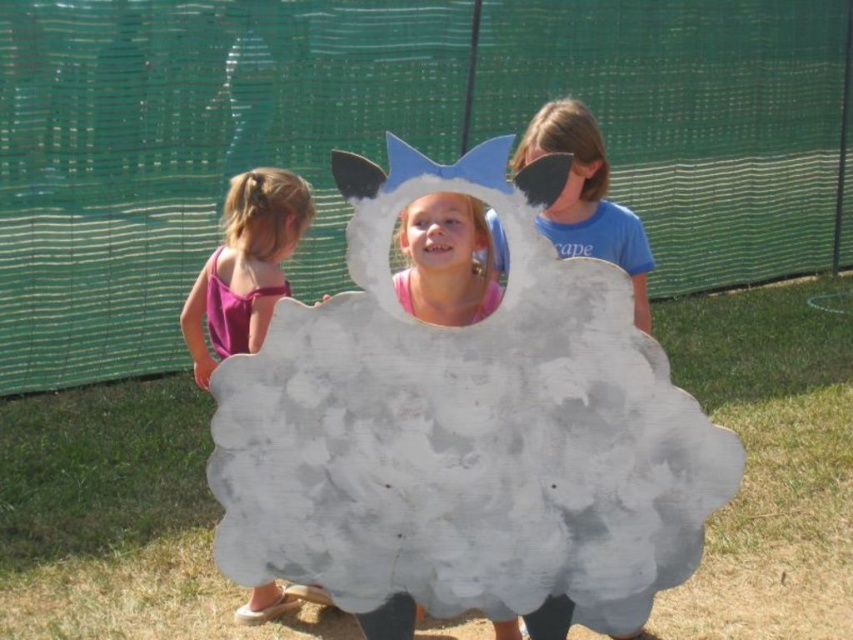
Can you confirm if white cotton cloud at center is shorter than matte pink dress at left?

In fact, white cotton cloud at center may be taller than matte pink dress at left.

Is white cotton cloud at center to the right of matte pink dress at left from the viewer's perspective?

Yes, white cotton cloud at center is to the right of matte pink dress at left.

This screenshot has width=853, height=640. What are the coordinates of `white cotton cloud at center` in the screenshot? It's located at (463, 432).

Is point (276, 202) positioned after point (480, 284)?

Yes, point (276, 202) is behind point (480, 284).

What do you see at coordinates (245, 266) in the screenshot? I see `matte pink dress at left` at bounding box center [245, 266].

Image resolution: width=853 pixels, height=640 pixels. What do you see at coordinates (245, 266) in the screenshot?
I see `matte pink dress at left` at bounding box center [245, 266].

This screenshot has height=640, width=853. In order to click on matte pink dress at left in this screenshot , I will do `click(245, 266)`.

Is matte pink dress at left taller than matte blue mask at center?

Indeed, matte pink dress at left has a greater height compared to matte blue mask at center.

Between matte pink dress at left and matte blue mask at center, which one appears on the right side from the viewer's perspective?

matte blue mask at center

Does point (271, 593) come in front of point (546, 116)?

That is False.

Where is `matte pink dress at left`? matte pink dress at left is located at coordinates (245, 266).